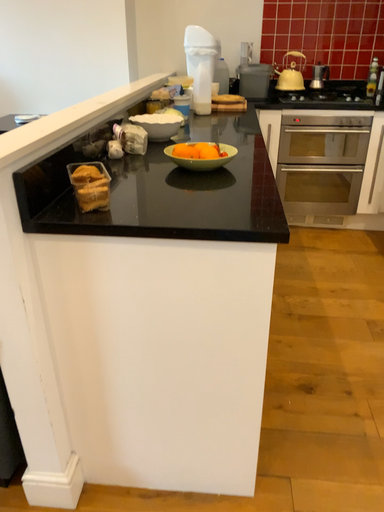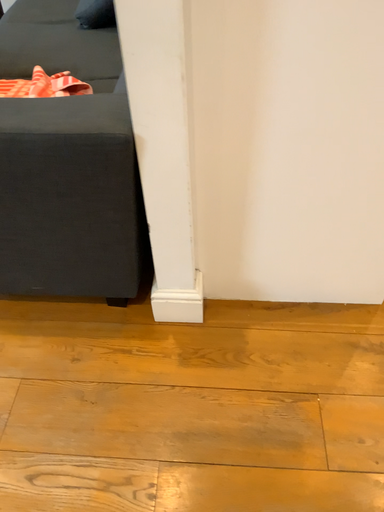
Question: Which way did the camera rotate in the video?

Choices:
 (A) rotated upward
 (B) rotated downward

Answer: (B)